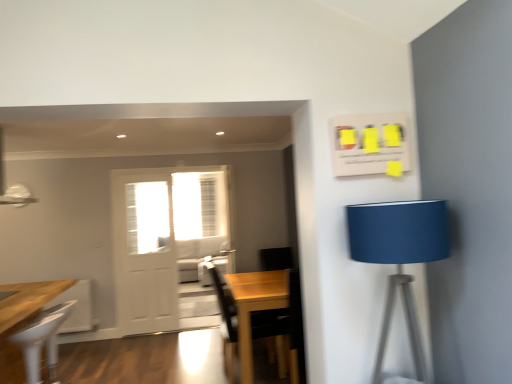
Question: Does point (211, 178) appear closer or farther from the camera than point (374, 223)?

Choices:
 (A) farther
 (B) closer

Answer: (A)

Question: From the image's perspective, is white sheer curtain at center above or below blue fabric lampshade at right?

Choices:
 (A) above
 (B) below

Answer: (A)

Question: Which object is positioned farthest from the white sheer curtain at center?

Choices:
 (A) blue fabric lampshade at right
 (B) white glossy screen door at center
 (C) white plastic chair at lower left
 (D) light gray fabric couch at center
 (E) white matte door at center

Answer: (A)

Question: Based on their relative distances, which object is farther from the white plastic chair at lower left?

Choices:
 (A) light gray fabric couch at center
 (B) blue fabric lampshade at right
 (C) white glossy screen door at center
 (D) wooden table at center
 (E) white sheer curtain at center

Answer: (B)